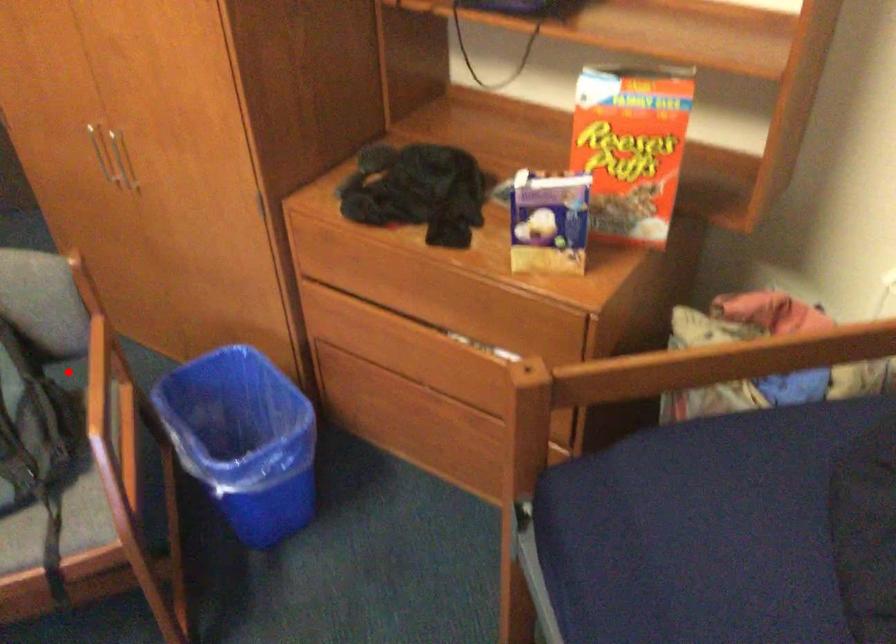
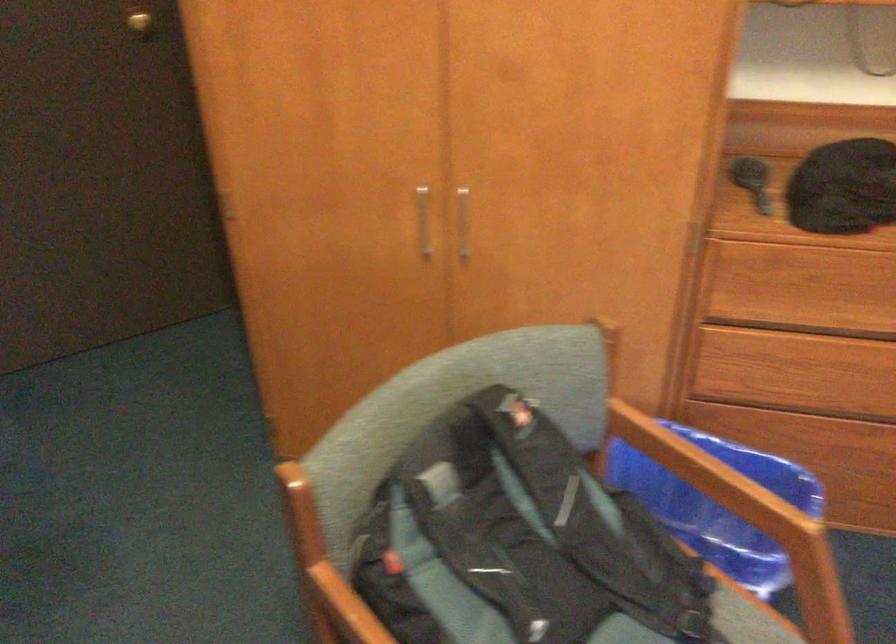
Question: I am providing you with two images of the same scene from different viewpoints. A red point is marked on the first image. Is the red point's position out of view in image 2?

Choices:
 (A) Yes
 (B) No

Answer: (A)